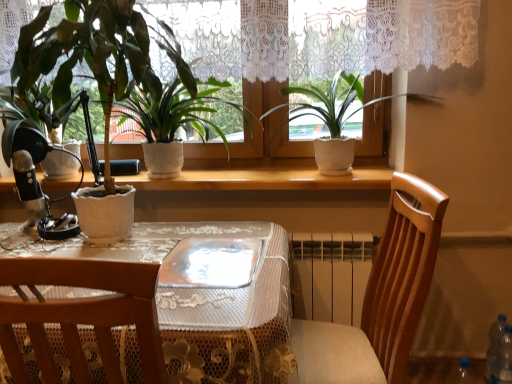
Question: Can you confirm if transparent plastic bottle at lower right is thinner than transparent glass plate at center?

Choices:
 (A) no
 (B) yes

Answer: (B)

Question: Is transparent plastic bottle at lower right outside transparent glass plate at center?

Choices:
 (A) yes
 (B) no

Answer: (A)

Question: Could transparent glass plate at center be considered to be inside transparent plastic bottle at lower right?

Choices:
 (A) yes
 (B) no

Answer: (B)

Question: Does transparent plastic bottle at lower right have a greater height compared to transparent glass plate at center?

Choices:
 (A) no
 (B) yes

Answer: (B)

Question: From a real-world perspective, does transparent plastic bottle at lower right stand above transparent glass plate at center?

Choices:
 (A) no
 (B) yes

Answer: (A)

Question: Relative to transparent glass plate at center, is wooden chair at center in front or behind?

Choices:
 (A) front
 (B) behind

Answer: (A)

Question: Does point (348, 377) appear closer or farther from the camera than point (246, 276)?

Choices:
 (A) closer
 (B) farther

Answer: (B)

Question: Is wooden chair at center bigger or smaller than transparent glass plate at center?

Choices:
 (A) small
 (B) big

Answer: (B)

Question: From the image's perspective, is wooden chair at center located above or below transparent glass plate at center?

Choices:
 (A) above
 (B) below

Answer: (B)

Question: In the image, is white textured pot at center, which is the third houseplant from left to right, positioned in front of or behind transparent glass plate at center?

Choices:
 (A) behind
 (B) front

Answer: (A)

Question: Is white textured pot at center, placed as the 1th houseplant when sorted from right to left, bigger or smaller than transparent glass plate at center?

Choices:
 (A) big
 (B) small

Answer: (A)

Question: Would you say white textured pot at center, which is the third houseplant from left to right, is to the left or to the right of transparent glass plate at center in the picture?

Choices:
 (A) left
 (B) right

Answer: (B)

Question: From the image's perspective, is white textured pot at center, which is the third houseplant from left to right, located above or below transparent glass plate at center?

Choices:
 (A) below
 (B) above

Answer: (B)

Question: Is transparent plastic bottle at lower right wider or thinner than matte white pot at left, the 1th houseplant in the left-to-right sequence?

Choices:
 (A) thin
 (B) wide

Answer: (A)

Question: Is transparent plastic bottle at lower right to the left or to the right of matte white pot at left, which is the third houseplant in right-to-left order, in the image?

Choices:
 (A) left
 (B) right

Answer: (B)